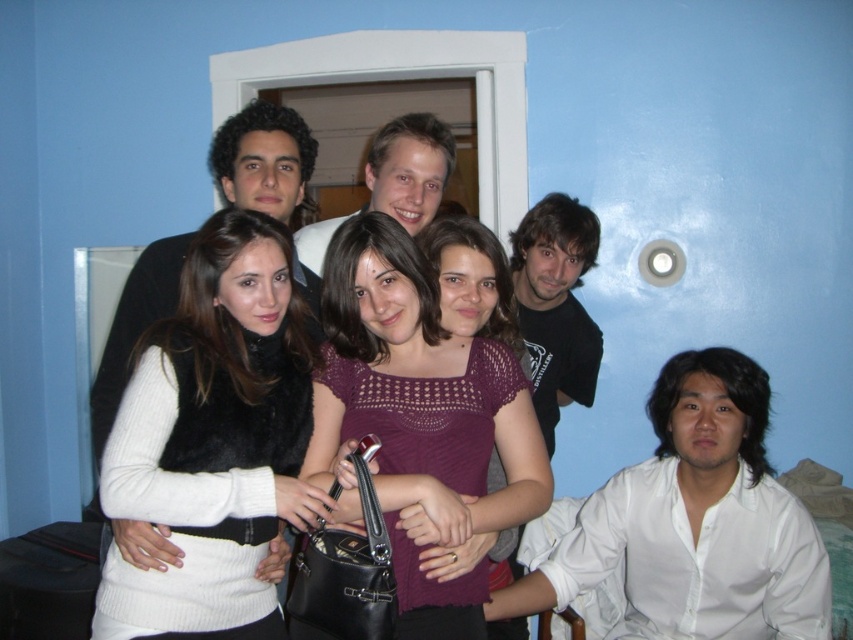
Is white smooth shirt at lower right to the left of dark brown hair at center from the viewer's perspective?

Incorrect, white smooth shirt at lower right is not on the left side of dark brown hair at center.

Between white smooth shirt at lower right and dark brown hair at center, which one appears on the right side from the viewer's perspective?

From the viewer's perspective, white smooth shirt at lower right appears more on the right side.

Between point (766, 524) and point (553, 204), which one is positioned in front?

Point (766, 524) is more forward.

Locate an element on the screen. The height and width of the screenshot is (640, 853). white smooth shirt at lower right is located at coordinates (694, 522).

Which is in front, point (553, 196) or point (440, 280)?

Point (440, 280) is more forward.

Where is `dark brown hair at center`? dark brown hair at center is located at coordinates (556, 305).

Which is more to the left, white fuzzy vest at center or crochet knit top at center?

white fuzzy vest at center

Looking at this image, is white fuzzy vest at center smaller than crochet knit top at center?

Yes, white fuzzy vest at center is smaller than crochet knit top at center.

Is point (161, 429) farther from viewer compared to point (486, 552)?

No, it is in front of (486, 552).

This screenshot has height=640, width=853. I want to click on white fuzzy vest at center, so click(213, 440).